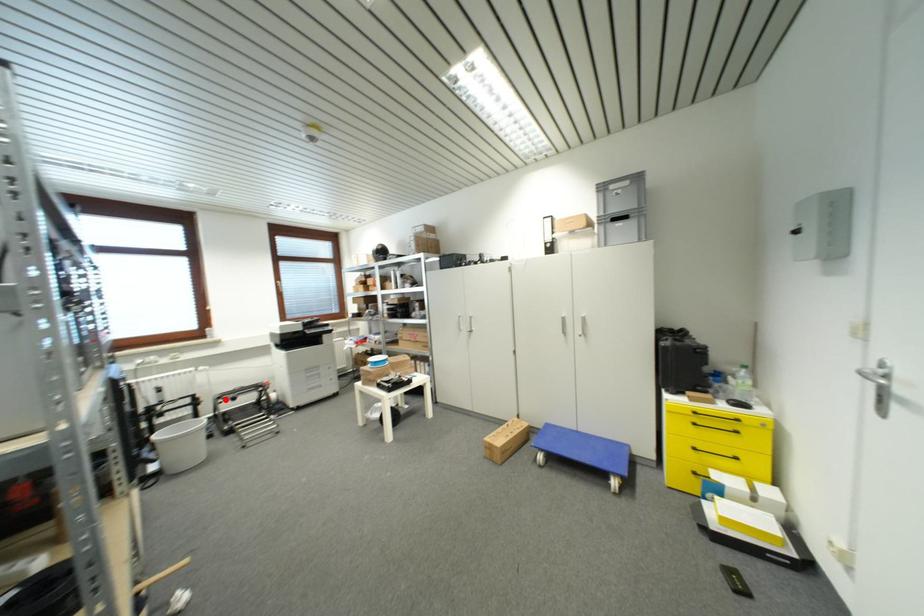
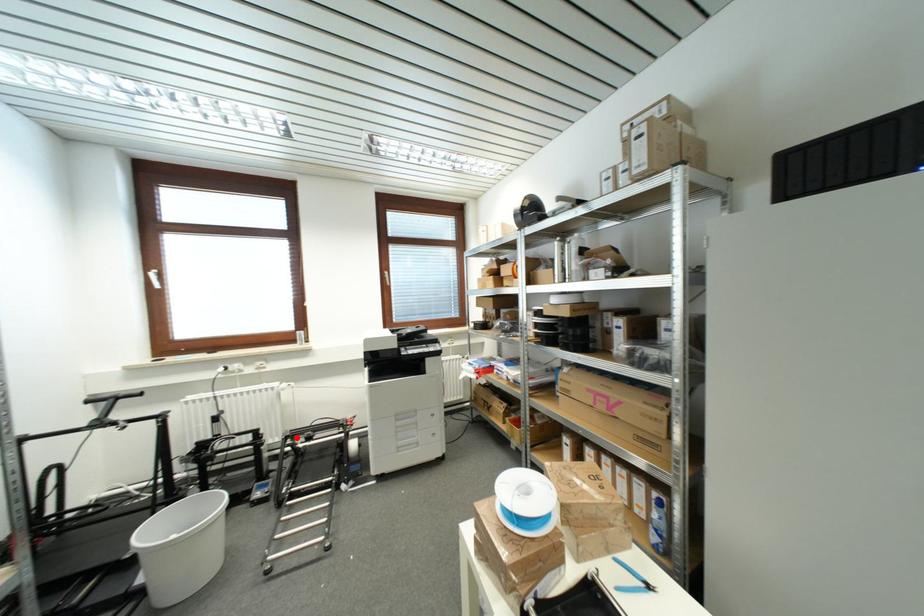
I am providing you with two images of the same scene from different viewpoints. A red point is marked on the first image and another point is marked on the second image. Does the point marked in image1 correspond to the same location as the one in image2?

Yes